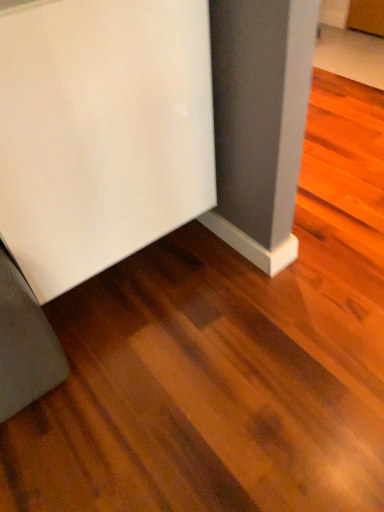
Describe the element at coordinates (24, 343) in the screenshot. Image resolution: width=384 pixels, height=512 pixels. I see `matte gray baseboard at lower left, which appears as the first furniture when ordered from the bottom` at that location.

Locate an element on the screen. Image resolution: width=384 pixels, height=512 pixels. matte gray baseboard at lower left, positioned as the second furniture in top-to-bottom order is located at coordinates tap(24, 343).

What is the approximate height of white glossy refrigerator at lower left, which ranks as the 2th furniture in bottom-to-top order?

It is 25.96 inches.

Find the location of a particular element. white glossy refrigerator at lower left, which ranks as the 2th furniture in bottom-to-top order is located at coordinates (101, 131).

What do you see at coordinates (101, 131) in the screenshot? I see `white glossy refrigerator at lower left, the first furniture from the top` at bounding box center [101, 131].

In order to click on matte gray baseboard at lower left, which appears as the first furniture when ordered from the bottom in this screenshot , I will do `click(24, 343)`.

Does white glossy refrigerator at lower left, the first furniture from the top, appear on the left side of matte gray baseboard at lower left, which appears as the first furniture when ordered from the bottom?

In fact, white glossy refrigerator at lower left, the first furniture from the top, is to the right of matte gray baseboard at lower left, which appears as the first furniture when ordered from the bottom.

Relative to matte gray baseboard at lower left, which appears as the first furniture when ordered from the bottom, is white glossy refrigerator at lower left, the first furniture from the top, in front or behind?

Clearly, white glossy refrigerator at lower left, the first furniture from the top, is in front of matte gray baseboard at lower left, which appears as the first furniture when ordered from the bottom.

Does point (213, 151) come farther from viewer compared to point (31, 319)?

Yes, point (213, 151) is farther from viewer.

From the image's perspective, would you say white glossy refrigerator at lower left, the first furniture from the top, is positioned over matte gray baseboard at lower left, which appears as the first furniture when ordered from the bottom?

Yes.

From a real-world perspective, which is physically above, white glossy refrigerator at lower left, the first furniture from the top, or matte gray baseboard at lower left, which appears as the first furniture when ordered from the bottom?

white glossy refrigerator at lower left, the first furniture from the top, from a real-world perspective.

Considering the relative sizes of white glossy refrigerator at lower left, the first furniture from the top, and matte gray baseboard at lower left, which appears as the first furniture when ordered from the bottom, in the image provided, is white glossy refrigerator at lower left, the first furniture from the top, wider than matte gray baseboard at lower left, which appears as the first furniture when ordered from the bottom,?

No, white glossy refrigerator at lower left, the first furniture from the top, is not wider than matte gray baseboard at lower left, which appears as the first furniture when ordered from the bottom.

Considering the sizes of objects white glossy refrigerator at lower left, which ranks as the 2th furniture in bottom-to-top order, and matte gray baseboard at lower left, positioned as the second furniture in top-to-bottom order, in the image provided, who is shorter, white glossy refrigerator at lower left, which ranks as the 2th furniture in bottom-to-top order, or matte gray baseboard at lower left, positioned as the second furniture in top-to-bottom order,?

matte gray baseboard at lower left, positioned as the second furniture in top-to-bottom order.

Who is bigger, white glossy refrigerator at lower left, which ranks as the 2th furniture in bottom-to-top order, or matte gray baseboard at lower left, positioned as the second furniture in top-to-bottom order?

Bigger between the two is white glossy refrigerator at lower left, which ranks as the 2th furniture in bottom-to-top order.

Do you think white glossy refrigerator at lower left, which ranks as the 2th furniture in bottom-to-top order, is within matte gray baseboard at lower left, positioned as the second furniture in top-to-bottom order, or outside of it?

white glossy refrigerator at lower left, which ranks as the 2th furniture in bottom-to-top order, exists outside the volume of matte gray baseboard at lower left, positioned as the second furniture in top-to-bottom order.

Is the surface of white glossy refrigerator at lower left, which ranks as the 2th furniture in bottom-to-top order, in direct contact with matte gray baseboard at lower left, which appears as the first furniture when ordered from the bottom?

No, white glossy refrigerator at lower left, which ranks as the 2th furniture in bottom-to-top order, is not with matte gray baseboard at lower left, which appears as the first furniture when ordered from the bottom.

Is white glossy refrigerator at lower left, which ranks as the 2th furniture in bottom-to-top order, aimed at matte gray baseboard at lower left, which appears as the first furniture when ordered from the bottom?

No, white glossy refrigerator at lower left, which ranks as the 2th furniture in bottom-to-top order, is not oriented towards matte gray baseboard at lower left, which appears as the first furniture when ordered from the bottom.

How different are the orientations of white glossy refrigerator at lower left, which ranks as the 2th furniture in bottom-to-top order, and matte gray baseboard at lower left, positioned as the second furniture in top-to-bottom order, in degrees?

0.000183 degrees.

Measure the distance between white glossy refrigerator at lower left, the first furniture from the top, and matte gray baseboard at lower left, which appears as the first furniture when ordered from the bottom.

white glossy refrigerator at lower left, the first furniture from the top, is 11.55 inches from matte gray baseboard at lower left, which appears as the first furniture when ordered from the bottom.

Locate an element on the screen. furniture below the white glossy refrigerator at lower left, the first furniture from the top (from a real-world perspective) is located at coordinates (24, 343).

Is matte gray baseboard at lower left, which appears as the first furniture when ordered from the bottom, to the left of white glossy refrigerator at lower left, which ranks as the 2th furniture in bottom-to-top order, from the viewer's perspective?

Correct, you'll find matte gray baseboard at lower left, which appears as the first furniture when ordered from the bottom, to the left of white glossy refrigerator at lower left, which ranks as the 2th furniture in bottom-to-top order.

Is matte gray baseboard at lower left, which appears as the first furniture when ordered from the bottom, positioned before white glossy refrigerator at lower left, which ranks as the 2th furniture in bottom-to-top order?

No, matte gray baseboard at lower left, which appears as the first furniture when ordered from the bottom, is further to the viewer.

Between point (18, 297) and point (157, 101), which one is positioned in front?

Point (18, 297)

From the image's perspective, between matte gray baseboard at lower left, which appears as the first furniture when ordered from the bottom, and white glossy refrigerator at lower left, the first furniture from the top, which one is located above?

white glossy refrigerator at lower left, the first furniture from the top, is shown above in the image.

From a real-world perspective, is matte gray baseboard at lower left, positioned as the second furniture in top-to-bottom order, on top of white glossy refrigerator at lower left, the first furniture from the top?

No.

Considering the sizes of objects matte gray baseboard at lower left, positioned as the second furniture in top-to-bottom order, and white glossy refrigerator at lower left, which ranks as the 2th furniture in bottom-to-top order, in the image provided, who is thinner, matte gray baseboard at lower left, positioned as the second furniture in top-to-bottom order, or white glossy refrigerator at lower left, which ranks as the 2th furniture in bottom-to-top order,?

white glossy refrigerator at lower left, which ranks as the 2th furniture in bottom-to-top order.

Between matte gray baseboard at lower left, positioned as the second furniture in top-to-bottom order, and white glossy refrigerator at lower left, which ranks as the 2th furniture in bottom-to-top order, which one has more height?

With more height is white glossy refrigerator at lower left, which ranks as the 2th furniture in bottom-to-top order.

Considering the relative sizes of matte gray baseboard at lower left, which appears as the first furniture when ordered from the bottom, and white glossy refrigerator at lower left, the first furniture from the top, in the image provided, is matte gray baseboard at lower left, which appears as the first furniture when ordered from the bottom, bigger than white glossy refrigerator at lower left, the first furniture from the top,?

No, matte gray baseboard at lower left, which appears as the first furniture when ordered from the bottom, is not bigger than white glossy refrigerator at lower left, the first furniture from the top.

Is matte gray baseboard at lower left, which appears as the first furniture when ordered from the bottom, spatially inside white glossy refrigerator at lower left, which ranks as the 2th furniture in bottom-to-top order, or outside of it?

matte gray baseboard at lower left, which appears as the first furniture when ordered from the bottom, cannot be found inside white glossy refrigerator at lower left, which ranks as the 2th furniture in bottom-to-top order.

Can you see matte gray baseboard at lower left, which appears as the first furniture when ordered from the bottom, touching white glossy refrigerator at lower left, the first furniture from the top?

There is a gap between matte gray baseboard at lower left, which appears as the first furniture when ordered from the bottom, and white glossy refrigerator at lower left, the first furniture from the top.

Is matte gray baseboard at lower left, which appears as the first furniture when ordered from the bottom, turned away from white glossy refrigerator at lower left, the first furniture from the top?

No, white glossy refrigerator at lower left, the first furniture from the top, is not at the back of matte gray baseboard at lower left, which appears as the first furniture when ordered from the bottom.

Locate an element on the screen. furniture that is above the matte gray baseboard at lower left, positioned as the second furniture in top-to-bottom order (from the image's perspective) is located at coordinates pyautogui.click(x=101, y=131).

The image size is (384, 512). What are the coordinates of `furniture in front of the matte gray baseboard at lower left, positioned as the second furniture in top-to-bottom order` in the screenshot? It's located at (101, 131).

At what (x,y) coordinates should I click in order to perform the action: click on furniture located behind the white glossy refrigerator at lower left, which ranks as the 2th furniture in bottom-to-top order. Please return your answer as a coordinate pair (x, y). This screenshot has width=384, height=512. Looking at the image, I should click on (24, 343).